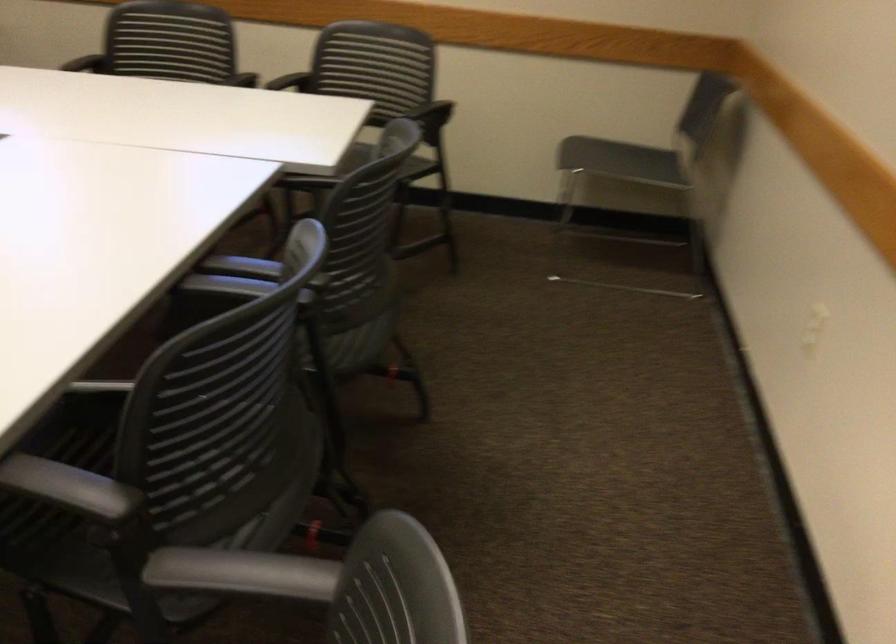
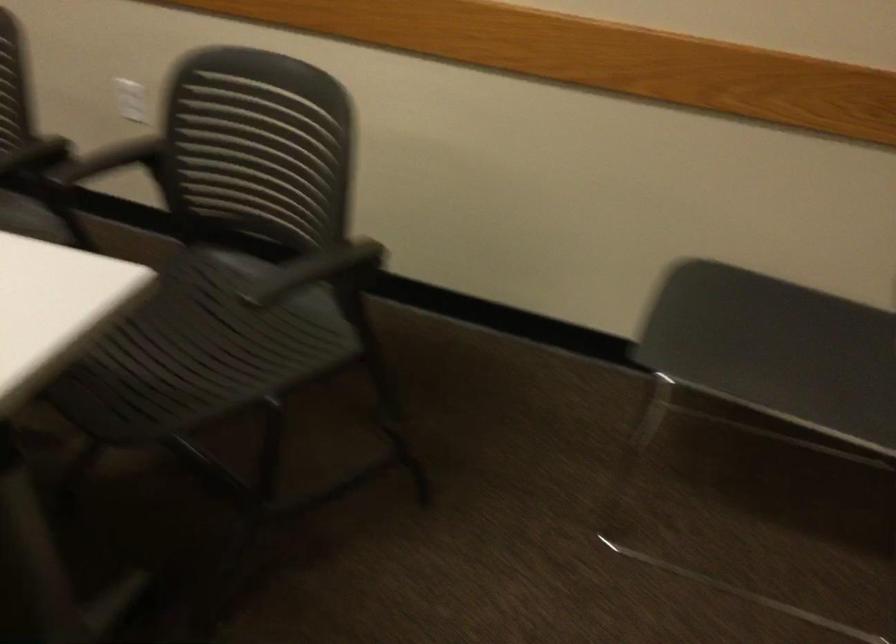
Question: In a continuous first-person perspective shot, in which direction is the camera moving?

Choices:
 (A) Left
 (B) Right
 (C) Forward
 (D) Backward

Answer: (C)